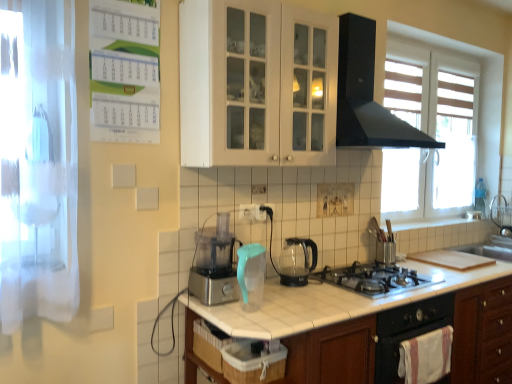
Question: Which direction should I rotate to look at white plastic electric outlet at center, the 1th electric outlet in the left-to-right sequence?

Choices:
 (A) right
 (B) left

Answer: (B)

Question: Considering the relative sizes of white tile countertop at center and transparent fabric screen door at left in the image provided, is white tile countertop at center taller than transparent fabric screen door at left?

Choices:
 (A) yes
 (B) no

Answer: (B)

Question: Is the position of white tile countertop at center less distant than that of transparent fabric screen door at left?

Choices:
 (A) yes
 (B) no

Answer: (B)

Question: Would you say white tile countertop at center is a long distance from transparent fabric screen door at left?

Choices:
 (A) yes
 (B) no

Answer: (A)

Question: Is white tile countertop at center wider than transparent fabric screen door at left?

Choices:
 (A) yes
 (B) no

Answer: (A)

Question: Could you tell me if white tile countertop at center is facing transparent fabric screen door at left?

Choices:
 (A) no
 (B) yes

Answer: (A)

Question: Is transparent fabric screen door at left at the back of white tile countertop at center?

Choices:
 (A) yes
 (B) no

Answer: (B)

Question: Considering the relative sizes of white plastic electric outlet at center, which is counted as the 1th electric outlet, starting from the front, and black matte range hood at upper center in the image provided, is white plastic electric outlet at center, which is counted as the 1th electric outlet, starting from the front, shorter than black matte range hood at upper center?

Choices:
 (A) no
 (B) yes

Answer: (B)

Question: Are white plastic electric outlet at center, which appears as the second electric outlet when viewed from the back, and black matte range hood at upper center making contact?

Choices:
 (A) yes
 (B) no

Answer: (B)

Question: Can you confirm if white plastic electric outlet at center, which appears as the second electric outlet when viewed from the back, is smaller than black matte range hood at upper center?

Choices:
 (A) yes
 (B) no

Answer: (A)

Question: Does white plastic electric outlet at center, placed as the 2th electric outlet when sorted from right to left, lie behind black matte range hood at upper center?

Choices:
 (A) no
 (B) yes

Answer: (B)

Question: Can you confirm if white plastic electric outlet at center, which is counted as the 1th electric outlet, starting from the front, is bigger than black matte range hood at upper center?

Choices:
 (A) no
 (B) yes

Answer: (A)

Question: Is white plastic electric outlet at center, which is counted as the 1th electric outlet, starting from the front, outside of black matte range hood at upper center?

Choices:
 (A) no
 (B) yes

Answer: (B)

Question: Is transparent fabric screen door at left oriented towards black plastic electric outlet at center, positioned as the 2th electric outlet in front-to-back order?

Choices:
 (A) no
 (B) yes

Answer: (A)